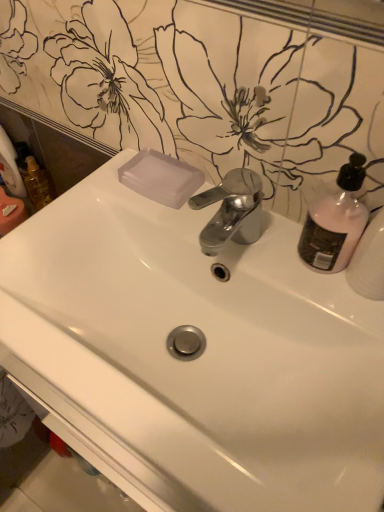
Where is `white matte toilet paper at left`? The width and height of the screenshot is (384, 512). white matte toilet paper at left is located at coordinates coord(10,166).

This screenshot has height=512, width=384. What do you see at coordinates (10, 166) in the screenshot? I see `white matte toilet paper at left` at bounding box center [10, 166].

What do you see at coordinates (335, 221) in the screenshot?
I see `pink matte bottle at upper right` at bounding box center [335, 221].

This screenshot has width=384, height=512. What are the coordinates of `translucent plastic soap at upper center` in the screenshot? It's located at (161, 178).

I want to click on translucent plastic mouthwash at left, so click(38, 184).

From the picture: Is translucent plastic soap at upper center with pink matte bottle at upper right?

No.

How many degrees apart are the facing directions of translucent plastic soap at upper center and pink matte bottle at upper right?

translucent plastic soap at upper center and pink matte bottle at upper right are facing 0.00307 degrees away from each other.

From a real-world perspective, is translucent plastic soap at upper center below pink matte bottle at upper right?

Indeed, from a real-world perspective, translucent plastic soap at upper center is positioned beneath pink matte bottle at upper right.

Can you confirm if translucent plastic soap at upper center is bigger than pink matte bottle at upper right?

Actually, translucent plastic soap at upper center might be smaller than pink matte bottle at upper right.

Considering the sizes of white glossy sink at center and pink matte bottle at upper right in the image, is white glossy sink at center bigger or smaller than pink matte bottle at upper right?

Clearly, white glossy sink at center is larger in size than pink matte bottle at upper right.

Can you confirm if white glossy sink at center is positioned to the right of pink matte bottle at upper right?

No.

Is white glossy sink at center outside of pink matte bottle at upper right?

Yes, white glossy sink at center is not within pink matte bottle at upper right.

At what (x,y) coordinates should I click in order to perform the action: click on toilet paper behind the pink matte bottle at upper right. Please return your answer as a coordinate pair (x, y). Looking at the image, I should click on (10, 166).

Which object is positioned more to the left, white matte toilet paper at left or pink matte bottle at upper right?

From the viewer's perspective, white matte toilet paper at left appears more on the left side.

Is point (6, 182) closer or farther from the camera than point (347, 166)?

Point (6, 182).

From a real-world perspective, relative to pink matte bottle at upper right, is white matte toilet paper at left vertically above or below?

In terms of real-world spatial position, white matte toilet paper at left is below pink matte bottle at upper right.

Does translucent plastic mouthwash at left come in front of translucent plastic soap at upper center?

No, translucent plastic mouthwash at left is behind translucent plastic soap at upper center.

From the image's perspective, which object appears higher, translucent plastic mouthwash at left or translucent plastic soap at upper center?

From the image's view, translucent plastic mouthwash at left is above.

Is point (27, 156) farther from viewer compared to point (180, 194)?

Yes, it is.

Which is correct: translucent plastic mouthwash at left is inside translucent plastic soap at upper center, or outside of it?

translucent plastic mouthwash at left is outside translucent plastic soap at upper center.

How different are the orientations of white glossy sink at center and white matte toilet paper at left in degrees?

0.141 degrees separate the facing orientations of white glossy sink at center and white matte toilet paper at left.

From a real-world perspective, relative to white matte toilet paper at left, is white glossy sink at center vertically above or below?

Clearly, from a real-world perspective, white glossy sink at center is below white matte toilet paper at left.

Is point (119, 318) farther from viewer compared to point (15, 195)?

No, it is not.

Can you confirm if white glossy sink at center is positioned to the left of white matte toilet paper at left?

No, white glossy sink at center is not to the left of white matte toilet paper at left.

Which of these two, translucent plastic soap at upper center or white glossy sink at center, stands taller?

Standing taller between the two is white glossy sink at center.

Which is behind, point (180, 187) or point (324, 351)?

The point (180, 187) is farther.

Is white glossy sink at center located within translucent plastic soap at upper center?

Actually, white glossy sink at center is outside translucent plastic soap at upper center.

Would you say translucent plastic soap at upper center is a long distance from white glossy sink at center?

Actually, translucent plastic soap at upper center and white glossy sink at center are a little close together.

From the picture: Measure the distance between translucent plastic soap at upper center and translucent plastic mouthwash at left.

A distance of 16.91 inches exists between translucent plastic soap at upper center and translucent plastic mouthwash at left.

From the image's perspective, which one is positioned higher, translucent plastic soap at upper center or translucent plastic mouthwash at left?

translucent plastic mouthwash at left appears higher in the image.

You are a GUI agent. You are given a task and a screenshot of the screen. Output one action in this format:
    pyautogui.click(x=<x>, y=<y>)
    Task: Click on the soap that is above the translucent plastic mouthwash at left (from a real-world perspective)
    Image resolution: width=384 pixels, height=512 pixels.
    Given the screenshot: What is the action you would take?
    click(x=161, y=178)

Is translucent plastic soap at upper center facing towards translucent plastic mouthwash at left?

No, translucent plastic soap at upper center is not facing towards translucent plastic mouthwash at left.

Find the location of `soap lying on the left of pink matte bottle at upper right`. soap lying on the left of pink matte bottle at upper right is located at coordinates (161, 178).

Where is `sink in front of the pink matte bottle at upper right`? This screenshot has width=384, height=512. sink in front of the pink matte bottle at upper right is located at coordinates coord(194,356).

Estimate the real-world distances between objects in this image. Which object is further from white matte toilet paper at left, white glossy sink at center or translucent plastic mouthwash at left?

white glossy sink at center is positioned further to the anchor white matte toilet paper at left.

Estimate the real-world distances between objects in this image. Which object is further from translucent plastic mouthwash at left, white glossy sink at center or translucent plastic soap at upper center?

The object further to translucent plastic mouthwash at left is white glossy sink at center.

Considering their positions, is translucent plastic mouthwash at left positioned further to white glossy sink at center than white matte toilet paper at left?

white matte toilet paper at left is further to white glossy sink at center.

Looking at the image, which one is located closer to translucent plastic soap at upper center, white glossy sink at center or translucent plastic mouthwash at left?

Based on the image, white glossy sink at center appears to be nearer to translucent plastic soap at upper center.

In the scene shown: Estimate the real-world distances between objects in this image. Which object is further from translucent plastic mouthwash at left, translucent plastic soap at upper center or white matte toilet paper at left?

translucent plastic soap at upper center is positioned further to the anchor translucent plastic mouthwash at left.

From the image, which object appears to be nearer to white glossy sink at center, pink matte bottle at upper right or white matte toilet paper at left?

Based on the image, pink matte bottle at upper right appears to be nearer to white glossy sink at center.

Based on their spatial positions, is translucent plastic soap at upper center or pink matte bottle at upper right closer to white glossy sink at center?

translucent plastic soap at upper center.

Looking at this image, based on their spatial positions, is pink matte bottle at upper right or white glossy sink at center further from translucent plastic soap at upper center?

The object further to translucent plastic soap at upper center is pink matte bottle at upper right.

The height and width of the screenshot is (512, 384). I want to click on soap between white glossy sink at center and translucent plastic mouthwash at left in the front-back direction, so click(161, 178).

Where is `toilet paper between white glossy sink at center and translucent plastic mouthwash at left along the z-axis`? toilet paper between white glossy sink at center and translucent plastic mouthwash at left along the z-axis is located at coordinates (10, 166).

This screenshot has width=384, height=512. What are the coordinates of `soap situated between translucent plastic mouthwash at left and pink matte bottle at upper right from left to right` in the screenshot? It's located at (161, 178).

The height and width of the screenshot is (512, 384). Identify the location of mouthwash between white matte toilet paper at left and translucent plastic soap at upper center in the horizontal direction. (38, 184).